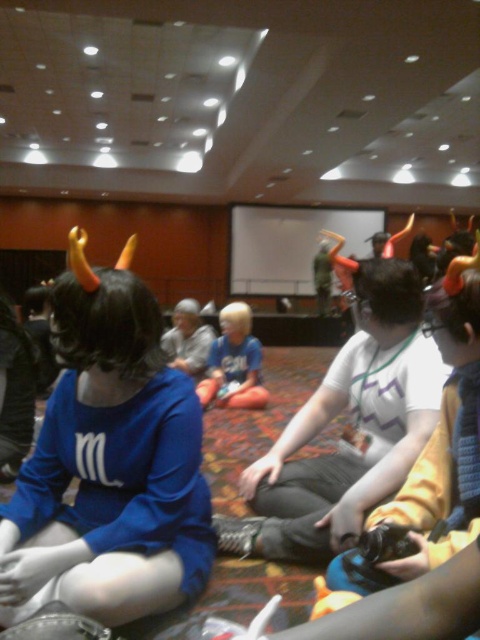
Question: Does matte blue shirt at center have a larger size compared to light blue fabric shirt at center?

Choices:
 (A) no
 (B) yes

Answer: (B)

Question: Which point is farther to the camera?

Choices:
 (A) (243, 372)
 (B) (100, 314)

Answer: (A)

Question: Can you confirm if matte blue shirt at center is positioned to the left of light blue fabric shirt at center?

Choices:
 (A) yes
 (B) no

Answer: (A)

Question: Can you confirm if matte blue shirt at center is wider than light blue fabric shirt at center?

Choices:
 (A) yes
 (B) no

Answer: (B)